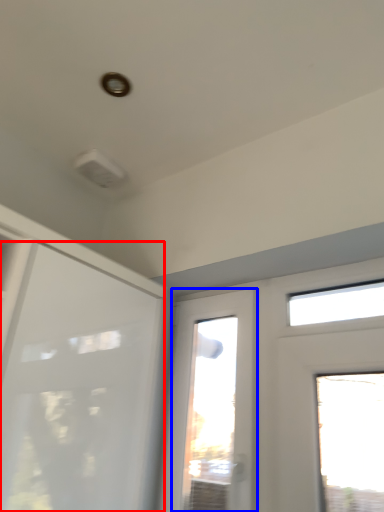
Question: Which object appears farthest to the camera in this image, door (highlighted by a red box) or window (highlighted by a blue box)?

Choices:
 (A) door
 (B) window

Answer: (B)